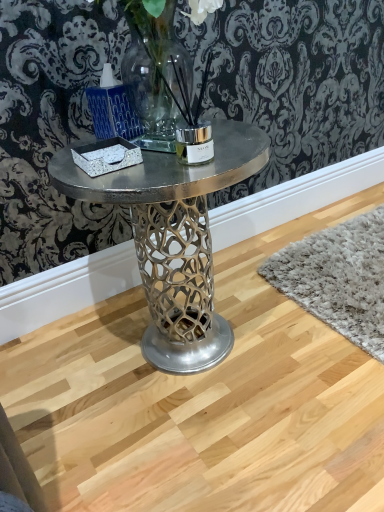
Image resolution: width=384 pixels, height=512 pixels. What do you see at coordinates (174, 238) in the screenshot?
I see `metallic silver table at center` at bounding box center [174, 238].

Identify the location of metallic silver table at center. (174, 238).

Measure the distance between point (x=170, y=330) and camera.

The depth of point (x=170, y=330) is 3.96 feet.

Find the location of a particular element. This screenshot has height=512, width=384. matte blue candle holder at upper left is located at coordinates 112,108.

Measure the distance between point (118, 86) and camera.

The distance of point (118, 86) from camera is 3.40 feet.

The width and height of the screenshot is (384, 512). What do you see at coordinates (112, 108) in the screenshot?
I see `matte blue candle holder at upper left` at bounding box center [112, 108].

Find the location of a particular element. The width and height of the screenshot is (384, 512). metallic silver table at center is located at coordinates (174, 238).

Which object is positioned more to the right, matte blue candle holder at upper left or metallic silver table at center?

metallic silver table at center is more to the right.

Does matte blue candle holder at upper left lie in front of metallic silver table at center?

Yes, matte blue candle holder at upper left is closer to the camera.

Is point (89, 105) closer or farther from the camera than point (149, 169)?

Point (89, 105) is positioned farther from the camera compared to point (149, 169).

From the image's perspective, relative to metallic silver table at center, is matte blue candle holder at upper left above or below?

matte blue candle holder at upper left is above metallic silver table at center.

Looking at this image, from a real-world perspective, who is located lower, matte blue candle holder at upper left or metallic silver table at center?

metallic silver table at center is physically lower.

Based on the photo, which object is wider, matte blue candle holder at upper left or metallic silver table at center?

With larger width is matte blue candle holder at upper left.

Considering the sizes of objects matte blue candle holder at upper left and metallic silver table at center in the image provided, who is shorter, matte blue candle holder at upper left or metallic silver table at center?

With less height is matte blue candle holder at upper left.

Does matte blue candle holder at upper left have a smaller size compared to metallic silver table at center?

Correct, matte blue candle holder at upper left occupies less space than metallic silver table at center.

Is matte blue candle holder at upper left situated inside metallic silver table at center or outside?

matte blue candle holder at upper left lies outside metallic silver table at center.

Are matte blue candle holder at upper left and metallic silver table at center beside each other?

No, matte blue candle holder at upper left is not touching metallic silver table at center.

Is matte blue candle holder at upper left looking in the opposite direction of metallic silver table at center?

matte blue candle holder at upper left is not turned away from metallic silver table at center.

The height and width of the screenshot is (512, 384). I want to click on coffee table below the matte blue candle holder at upper left (from the image's perspective), so pyautogui.click(x=174, y=238).

Which object is positioned more to the left, metallic silver table at center or matte blue candle holder at upper left?

From the viewer's perspective, matte blue candle holder at upper left appears more on the left side.

Based on the photo, considering their positions, is metallic silver table at center located in front of or behind matte blue candle holder at upper left?

Visually, metallic silver table at center is located behind matte blue candle holder at upper left.

Does point (189, 256) lie in front of point (113, 103)?

No, it is not.

From the image's perspective, which one is positioned higher, metallic silver table at center or matte blue candle holder at upper left?

A: From the image's view, matte blue candle holder at upper left is above.

From the picture: From a real-world perspective, is metallic silver table at center positioned over matte blue candle holder at upper left based on gravity?

Actually, metallic silver table at center is physically below matte blue candle holder at upper left in the real world.

Can you confirm if metallic silver table at center is wider than matte blue candle holder at upper left?

No.

From their relative heights in the image, would you say metallic silver table at center is taller or shorter than matte blue candle holder at upper left?

In the image, metallic silver table at center appears to be taller than matte blue candle holder at upper left.

Can you confirm if metallic silver table at center is bigger than matte blue candle holder at upper left?

Indeed, metallic silver table at center has a larger size compared to matte blue candle holder at upper left.

Is metallic silver table at center situated inside matte blue candle holder at upper left or outside?

metallic silver table at center exists outside the volume of matte blue candle holder at upper left.

Is metallic silver table at center touching matte blue candle holder at upper left?

No, metallic silver table at center is not touching matte blue candle holder at upper left.

Is metallic silver table at center facing towards matte blue candle holder at upper left?

No, metallic silver table at center is not turned towards matte blue candle holder at upper left.

Can you tell me how much metallic silver table at center and matte blue candle holder at upper left differ in facing direction?

They differ by 13.7 degrees in their facing directions.

Locate an element on the screen. The width and height of the screenshot is (384, 512). coffee table behind the matte blue candle holder at upper left is located at coordinates (174, 238).

Locate an element on the screen. Image resolution: width=384 pixels, height=512 pixels. candle holder lying above the metallic silver table at center (from the image's perspective) is located at coordinates (112, 108).

You are a GUI agent. You are given a task and a screenshot of the screen. Output one action in this format:
    pyautogui.click(x=<x>, y=<y>)
    Task: Click on the coffee table below the matte blue candle holder at upper left (from a real-world perspective)
    The image size is (384, 512).
    Given the screenshot: What is the action you would take?
    pyautogui.click(x=174, y=238)